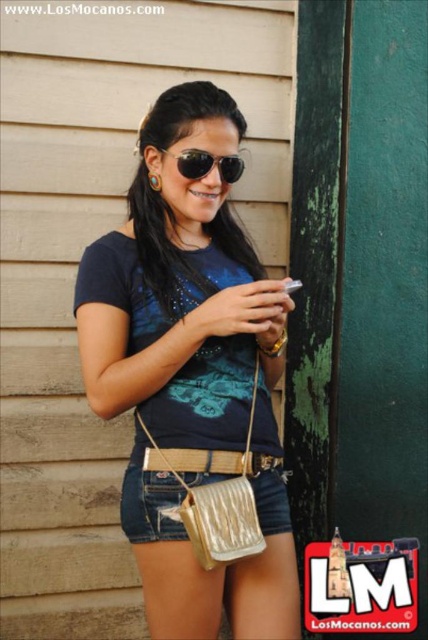
Question: Does metallic gold purse at center appear on the right side of sunglasses at center?

Choices:
 (A) yes
 (B) no

Answer: (B)

Question: Which point appears farthest from the camera in this image?

Choices:
 (A) (133, 516)
 (B) (222, 236)

Answer: (B)

Question: Does metallic gold purse at center appear under metallic gold purse at lower center?

Choices:
 (A) no
 (B) yes

Answer: (A)

Question: Is metallic gold purse at center bigger than sunglasses at center?

Choices:
 (A) yes
 (B) no

Answer: (A)

Question: Which of the following is the closest to the observer?

Choices:
 (A) metallic gold purse at lower center
 (B) metallic gold purse at center
 (C) sunglasses at center

Answer: (B)

Question: Which of the following is the closest to the observer?

Choices:
 (A) metallic gold purse at lower center
 (B) metallic gold purse at center

Answer: (B)